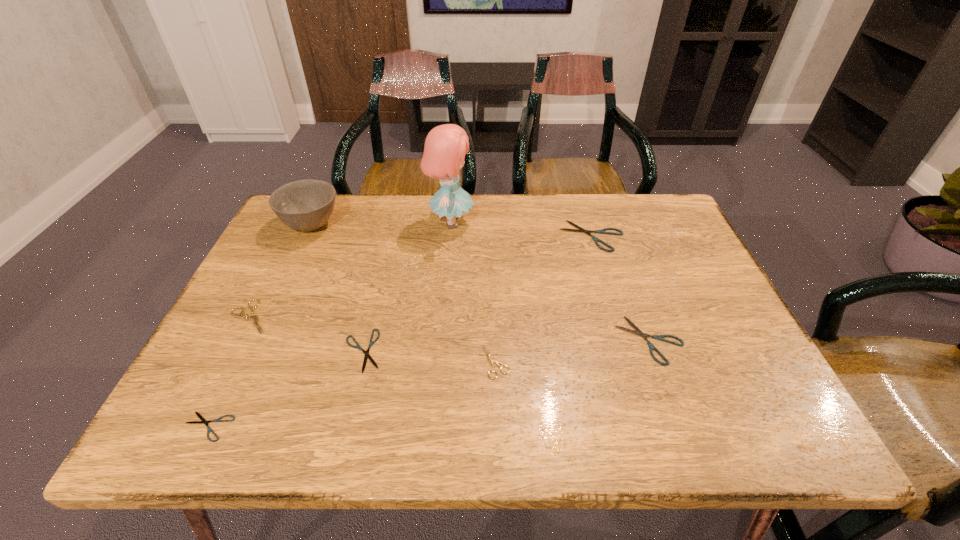
At what (x,y) coordinates should I click in order to perform the action: click on blue doll. Please return your answer as a coordinate pair (x, y). The width and height of the screenshot is (960, 540). Looking at the image, I should click on (445, 147).

The height and width of the screenshot is (540, 960). I want to click on the fourth object from right to left, so (445, 147).

You are a GUI agent. You are given a task and a screenshot of the screen. Output one action in this format:
    pyautogui.click(x=<x>, y=<y>)
    Task: Click on the bowl
    The height and width of the screenshot is (540, 960).
    Given the screenshot: What is the action you would take?
    pyautogui.click(x=305, y=205)

I want to click on the biggest black shears, so click(602, 231).

Where is `the farthest shears`? The height and width of the screenshot is (540, 960). the farthest shears is located at coordinates (602, 231).

What are the coordinates of `the farther beige shears` in the screenshot? It's located at (246, 316).

This screenshot has width=960, height=540. I want to click on the bigger beige shears, so click(x=246, y=316).

Where is `the second biggest black shears`? The height and width of the screenshot is (540, 960). the second biggest black shears is located at coordinates (659, 337).

Image resolution: width=960 pixels, height=540 pixels. Find the location of `the smaller beige shears`. the smaller beige shears is located at coordinates (491, 361).

The image size is (960, 540). What are the coordinates of `the nearer beige shears` in the screenshot? It's located at (491, 361).